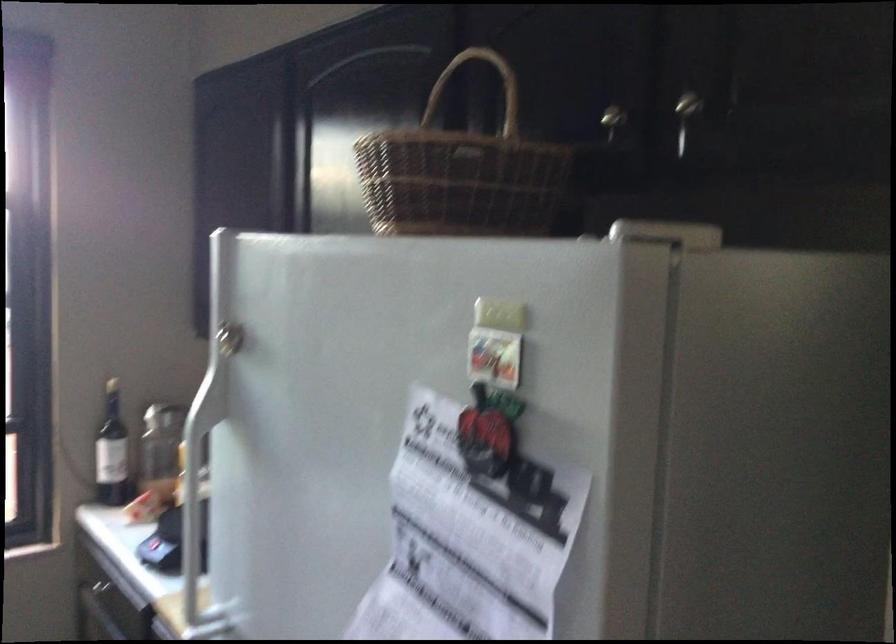
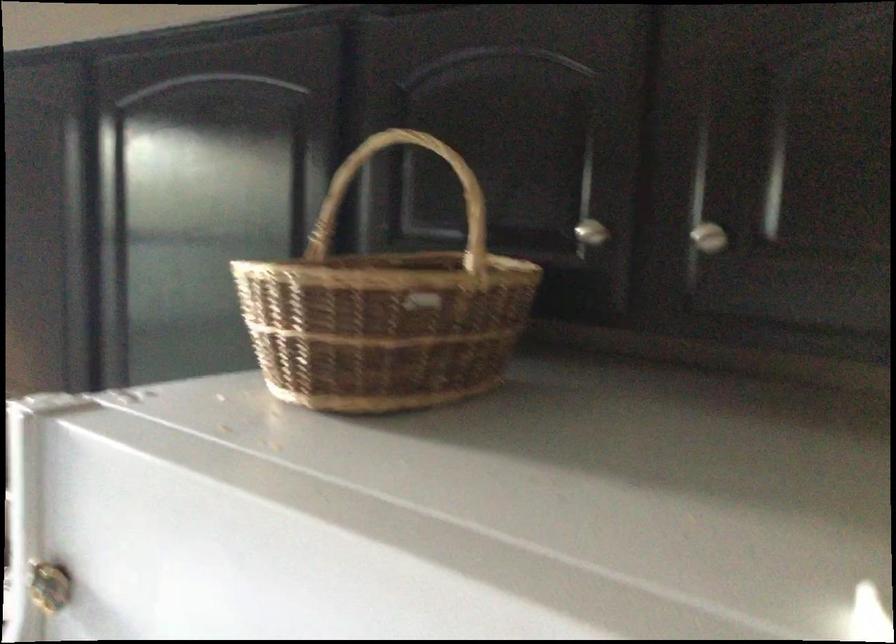
Find the pixel in the second image that matches (506,102) in the first image.

(428, 182)